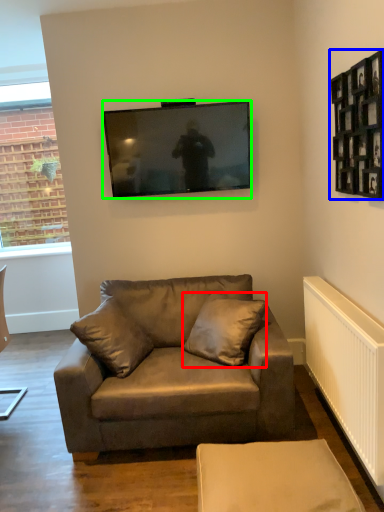
Question: Which object is the farthest from pillow (highlighted by a red box)? Choose among these: picture frame (highlighted by a blue box) or television (highlighted by a green box).

Choices:
 (A) picture frame
 (B) television

Answer: (A)